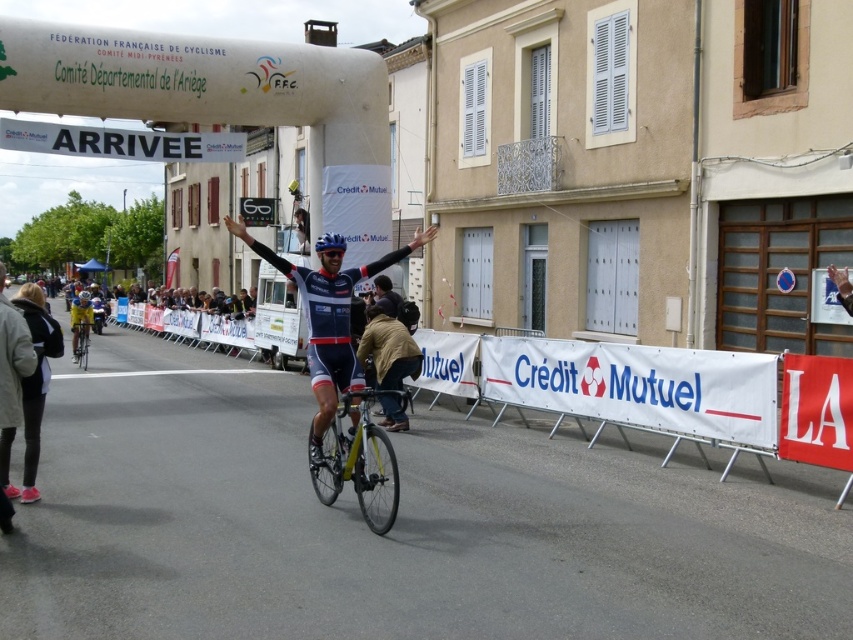
Does matte blue jersey at center appear over blue fabric jersey at center?

Indeed, matte blue jersey at center is positioned over blue fabric jersey at center.

Does matte blue jersey at center have a smaller size compared to blue fabric jersey at center?

Correct, matte blue jersey at center occupies less space than blue fabric jersey at center.

Is point (384, 260) farther from viewer compared to point (410, 378)?

No.

This screenshot has width=853, height=640. What are the coordinates of `matte blue jersey at center` in the screenshot? It's located at (328, 316).

What do you see at coordinates (32, 390) in the screenshot? I see `dark gray jacket at lower left` at bounding box center [32, 390].

Who is positioned more to the right, dark gray jacket at lower left or yellow metallic bicycle at center?

dark gray jacket at lower left

Is point (33, 404) behind point (85, 355)?

No, (33, 404) is in front of (85, 355).

Find the location of a particular element. dark gray jacket at lower left is located at coordinates (32, 390).

Who is higher up, dark gray jacket at lower left or dark blue jersey at center?

dark blue jersey at center

This screenshot has width=853, height=640. Describe the element at coordinates (32, 390) in the screenshot. I see `dark gray jacket at lower left` at that location.

Where is `dark gray jacket at lower left`? The height and width of the screenshot is (640, 853). dark gray jacket at lower left is located at coordinates (32, 390).